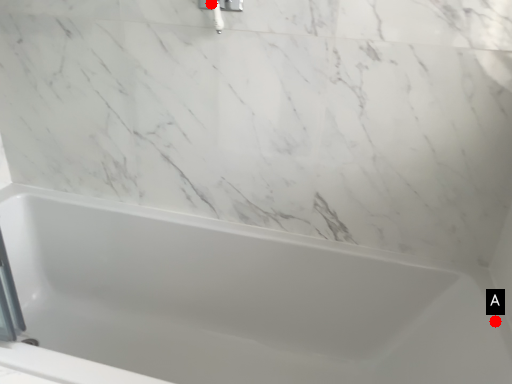
Question: Two points are circled on the image, labeled by A and B beside each circle. Which point is closer to the camera?

Choices:
 (A) A is closer
 (B) B is closer

Answer: (B)